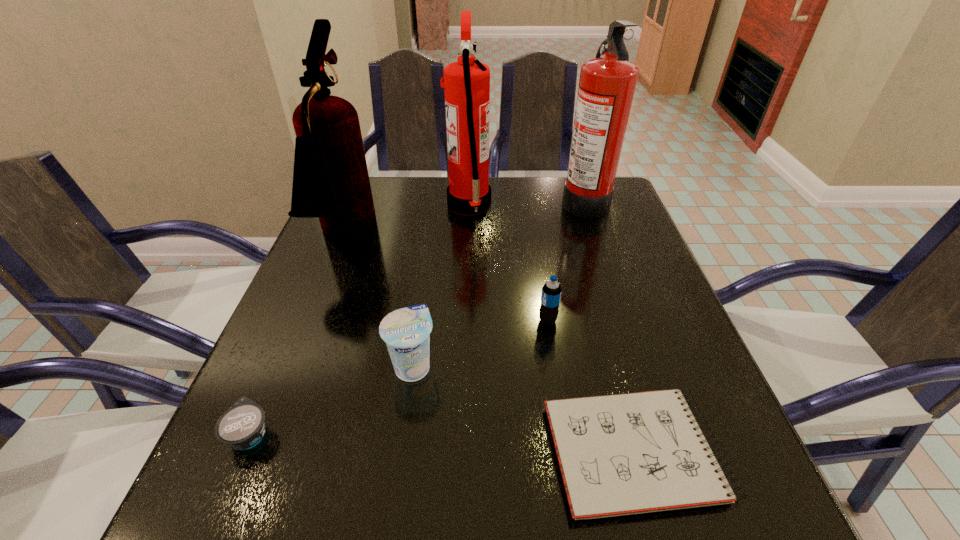
Where is `free space that is in between the rightmost fire extinguisher and the second fire extinguisher from left to right`? The width and height of the screenshot is (960, 540). free space that is in between the rightmost fire extinguisher and the second fire extinguisher from left to right is located at coordinates (527, 202).

Find the location of a particular element. Image resolution: width=960 pixels, height=540 pixels. object that is the third nearest to the rightmost fire extinguisher is located at coordinates (330, 178).

Identify which object is the fifth closest to the taller yogurt. Please provide its 2D coordinates. Your answer should be formatted as a tuple, i.e. [(x, y)], where the tuple contains the x and y coordinates of a point satisfying the conditions above.

[(466, 82)]

Where is `fire extinguisher that is the closest to the rightmost fire extinguisher`? The width and height of the screenshot is (960, 540). fire extinguisher that is the closest to the rightmost fire extinguisher is located at coordinates (466, 82).

Choose which fire extinguisher is the nearest neighbor to the leftmost fire extinguisher. Please provide its 2D coordinates. Your answer should be formatted as a tuple, i.e. [(x, y)], where the tuple contains the x and y coordinates of a point satisfying the conditions above.

[(466, 82)]

The width and height of the screenshot is (960, 540). I want to click on free space that satisfies the following two spatial constraints: 1. at the nozzle of the leftmost fire extinguisher; 2. on the right side of the farther yogurt, so click(294, 366).

Find the location of a particular element. vacant space that satisfies the following two spatial constraints: 1. with the nozzle aimed from the notepad; 2. on the right side of the second fire extinguisher from left to right is located at coordinates (461, 453).

In order to click on blank area in the image that satisfies the following two spatial constraints: 1. at the nozzle of the soda bottle; 2. on the left side of the leftmost fire extinguisher in this screenshot , I will do `click(312, 321)`.

Where is `blank area in the image that satisfies the following two spatial constraints: 1. with the nozzle aimed from the second fire extinguisher from left to right; 2. on the left side of the notepad`? This screenshot has height=540, width=960. blank area in the image that satisfies the following two spatial constraints: 1. with the nozzle aimed from the second fire extinguisher from left to right; 2. on the left side of the notepad is located at coordinates (461, 453).

You are a GUI agent. You are given a task and a screenshot of the screen. Output one action in this format:
    pyautogui.click(x=<x>, y=<y>)
    Task: Click on the free region that satisfies the following two spatial constraints: 1. with the nozzle aimed from the second fire extinguisher from left to right; 2. on the front side of the right yogurt
    
    Given the screenshot: What is the action you would take?
    pyautogui.click(x=464, y=366)